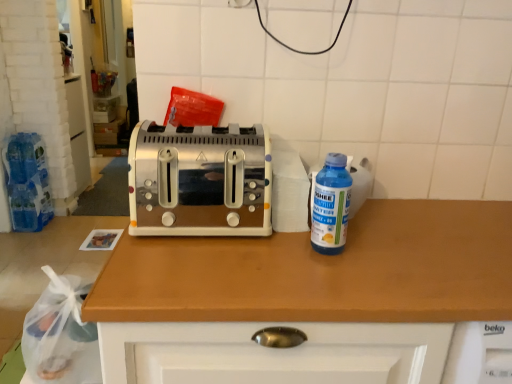
Question: From a real-world perspective, is wooden countertop at center beneath satin silver toaster at center?

Choices:
 (A) no
 (B) yes

Answer: (B)

Question: Is satin silver toaster at center inside wooden countertop at center?

Choices:
 (A) no
 (B) yes

Answer: (A)

Question: Is the depth of wooden countertop at center less than that of satin silver toaster at center?

Choices:
 (A) no
 (B) yes

Answer: (B)

Question: From the image's perspective, does wooden countertop at center appear lower than satin silver toaster at center?

Choices:
 (A) yes
 (B) no

Answer: (A)

Question: Can you confirm if wooden countertop at center is positioned to the left of satin silver toaster at center?

Choices:
 (A) yes
 (B) no

Answer: (B)

Question: Is wooden countertop at center facing away from satin silver toaster at center?

Choices:
 (A) no
 (B) yes

Answer: (A)

Question: Is the depth of blue plastic bottle at right greater than that of wooden countertop at center?

Choices:
 (A) yes
 (B) no

Answer: (A)

Question: Does blue plastic bottle at right have a greater width compared to wooden countertop at center?

Choices:
 (A) yes
 (B) no

Answer: (B)

Question: From the image's perspective, is blue plastic bottle at right below wooden countertop at center?

Choices:
 (A) yes
 (B) no

Answer: (B)

Question: Could you tell me if blue plastic bottle at right is turned towards wooden countertop at center?

Choices:
 (A) yes
 (B) no

Answer: (B)

Question: Is blue plastic bottle at right outside wooden countertop at center?

Choices:
 (A) yes
 (B) no

Answer: (A)

Question: Is the position of blue plastic bottle at right less distant than that of wooden countertop at center?

Choices:
 (A) no
 (B) yes

Answer: (A)

Question: Can we say blue plastic bottle at right lies outside satin silver toaster at center?

Choices:
 (A) yes
 (B) no

Answer: (A)